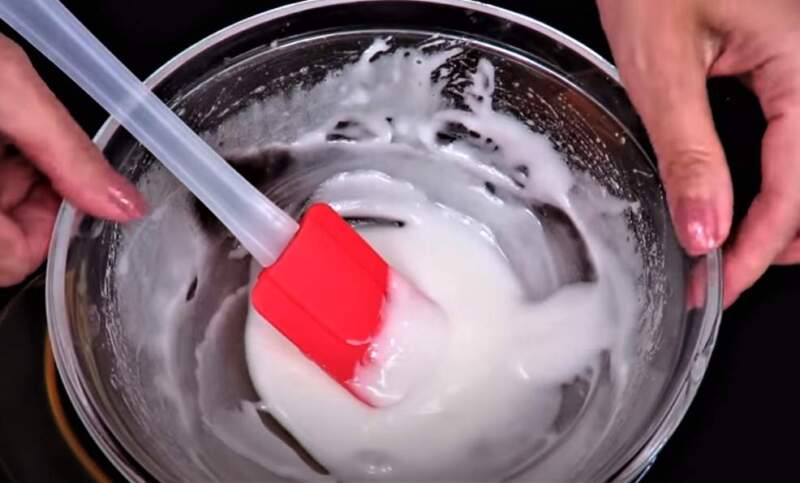
This screenshot has width=800, height=483. What are the coordinates of `blue plate` in the screenshot? It's located at (58, 440).